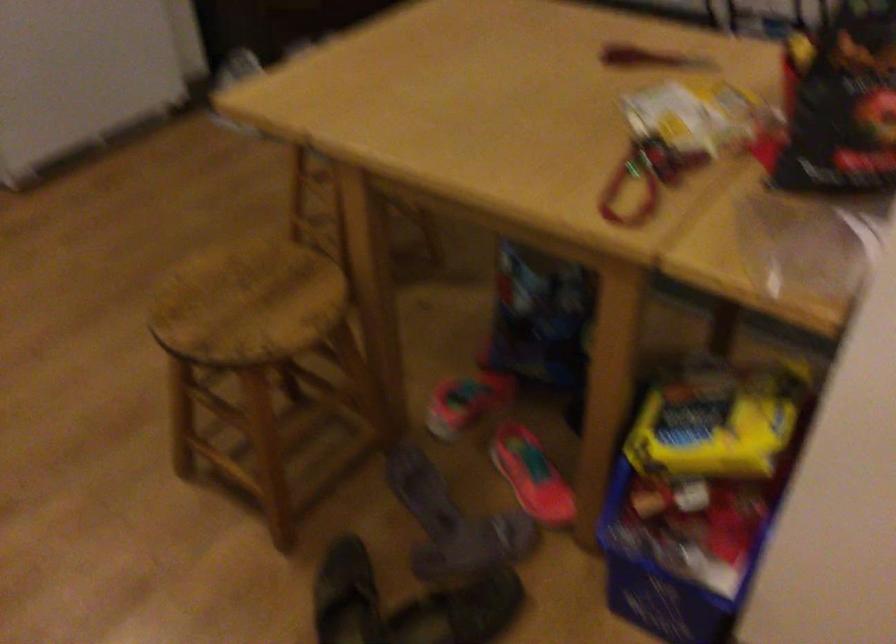
Where is `glass bowl`? The image size is (896, 644). glass bowl is located at coordinates (800, 245).